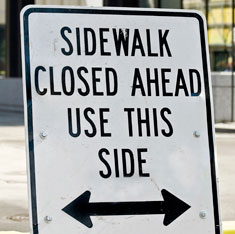
Identify the location of window in upper right corner. This screenshot has width=235, height=234. (218, 16).